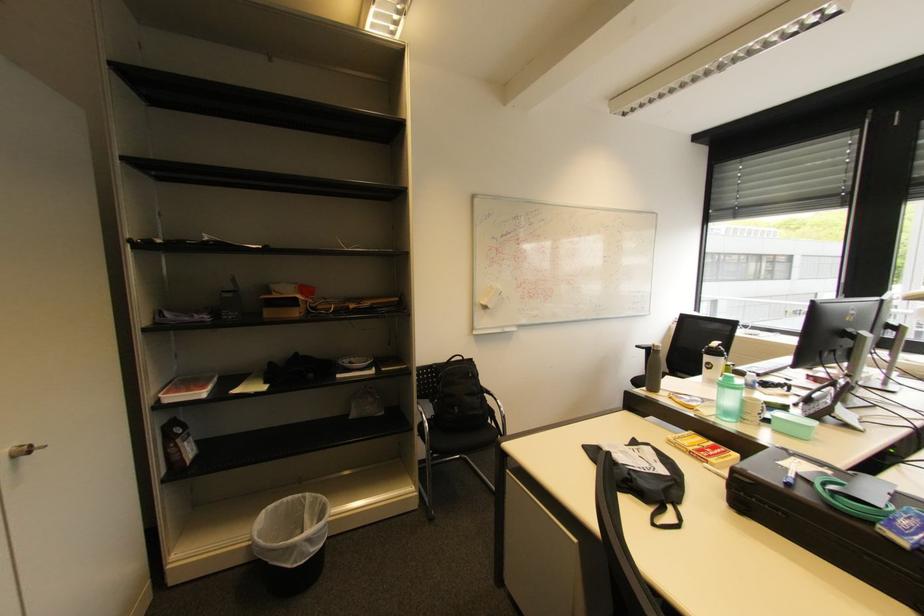
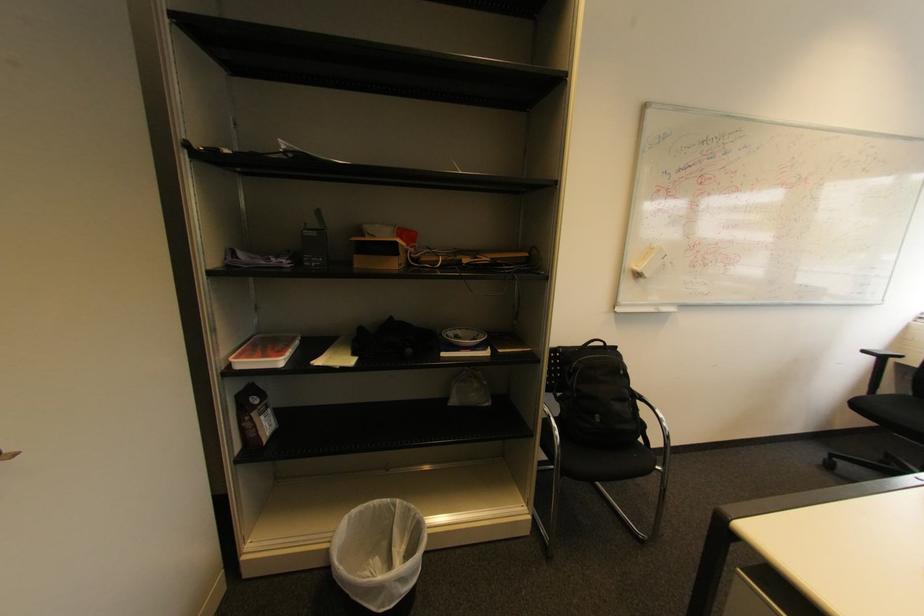
Where in the second image is the point corresponding to (358,360) from the first image?

(464, 333)